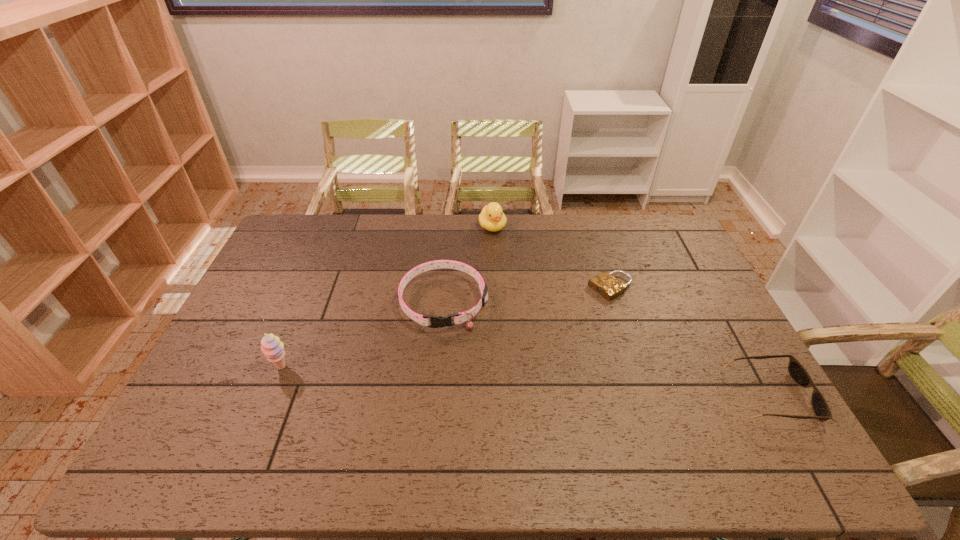
This screenshot has width=960, height=540. What are the coordinates of `object situated at the near edge` in the screenshot? It's located at (798, 373).

The width and height of the screenshot is (960, 540). What are the coordinates of `object that is at the right edge` in the screenshot? It's located at (798, 373).

In order to click on object located at the near right corner in this screenshot , I will do `click(798, 373)`.

This screenshot has width=960, height=540. In the image, there is a desktop. Find the location of `vacant space at the far edge`. vacant space at the far edge is located at coordinates (378, 214).

Locate an element on the screen. The image size is (960, 540). vacant region at the near edge of the desktop is located at coordinates click(341, 424).

What are the coordinates of `free point at the left edge` in the screenshot? It's located at (279, 302).

This screenshot has width=960, height=540. Identify the location of vacant space at the right edge. (672, 260).

At what (x,y) coordinates should I click in order to perform the action: click on free space at the near right corner of the desktop. Please return your answer as a coordinate pair (x, y). Looking at the image, I should click on tap(719, 400).

Locate an element on the screen. unoccupied position between the second object from right to left and the dog collar is located at coordinates (527, 295).

You are a GUI agent. You are given a task and a screenshot of the screen. Output one action in this format:
    pyautogui.click(x=<x>, y=<y>)
    Task: Click on the empty space between the tallest object and the fourth object from left to right
    The height and width of the screenshot is (540, 960).
    Given the screenshot: What is the action you would take?
    pyautogui.click(x=446, y=327)